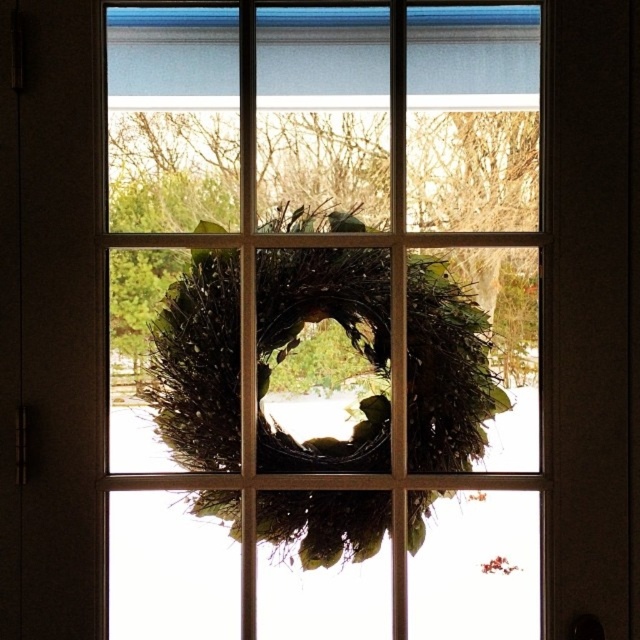
You are decorating a window and have two wreaths available. You want to place the larger one in the center of the window to match the scene. Which wreath should you choose between the green twig wreath at center and the green textured wreath at center?

The green twig wreath at center is larger in size than the green textured wreath at center, so you should choose the green twig wreath at center to place in the center of the window.

You are standing in front of the window and want to determine the spatial relationship between two points marked on the window frame. The first point is at coordinates point(461, 563) and the second is at point(440, 342). Which point is closer to you?

Point(461, 563) is in front of point(440, 342), so it is closer to you.

You are trying to hang a wreath on your window. You have two options from the image, the green twig wreath at center and the green textured wreath at center. Which one is taller?

The green twig wreath at center is taller than the green textured wreath at center.